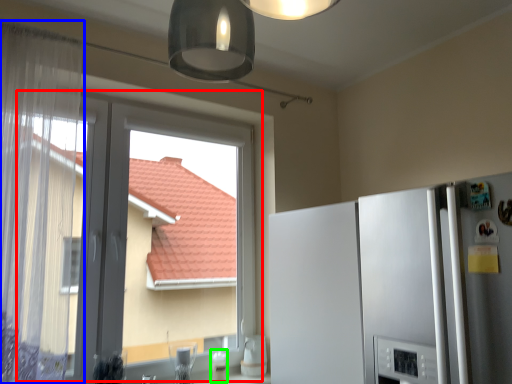
Question: Which object is the closest to the window (highlighted by a red box)? Choose among these: curtain (highlighted by a blue box) or appliance (highlighted by a green box).

Choices:
 (A) curtain
 (B) appliance

Answer: (A)